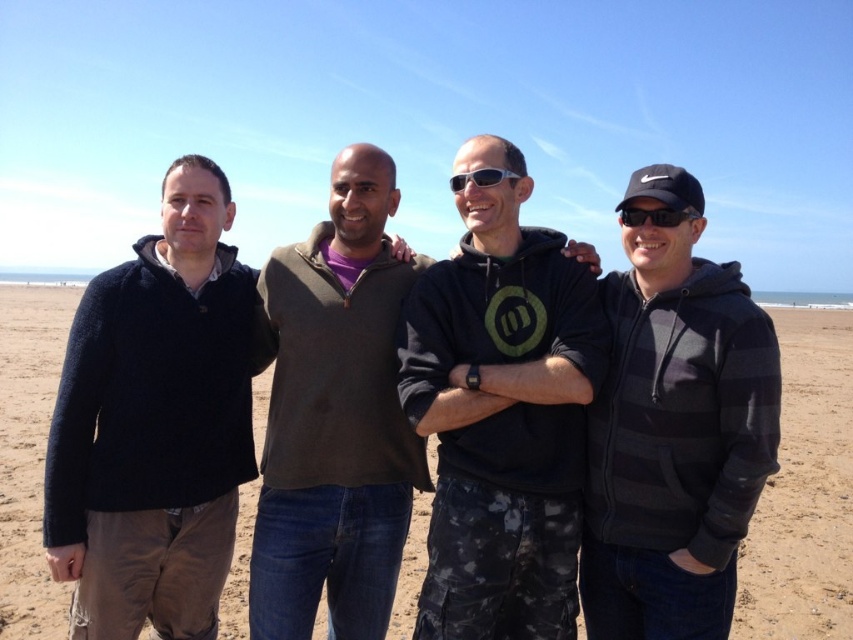
Question: Does striped hoodie at right appear over black plastic sunglasses at right?

Choices:
 (A) yes
 (B) no

Answer: (B)

Question: Among these points, which one is nearest to the camera?

Choices:
 (A) (804, 419)
 (B) (128, 536)
 (C) (625, 224)

Answer: (B)

Question: Is dark blue sweater at left smaller than sandy beach at lower center?

Choices:
 (A) yes
 (B) no

Answer: (A)

Question: Based on their relative distances, which object is farther from the dark gray sweater at center?

Choices:
 (A) sandy beach at lower center
 (B) black plastic sunglasses at right
 (C) dark blue sweater at left
 (D) striped hoodie at right

Answer: (A)

Question: Is dark blue sweater at left to the right of dark gray sweater at center from the viewer's perspective?

Choices:
 (A) yes
 (B) no

Answer: (B)

Question: Which of the following is the farthest from the observer?

Choices:
 (A) (709, 298)
 (B) (64, 536)
 (C) (22, 484)
 (D) (660, 211)

Answer: (C)